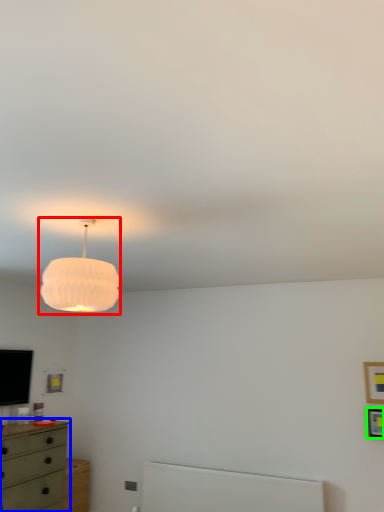
Question: Which object is the farthest from lamp (highlighted by a red box)? Choose among these: chest of drawers (highlighted by a blue box) or picture frame (highlighted by a green box).

Choices:
 (A) chest of drawers
 (B) picture frame

Answer: (B)